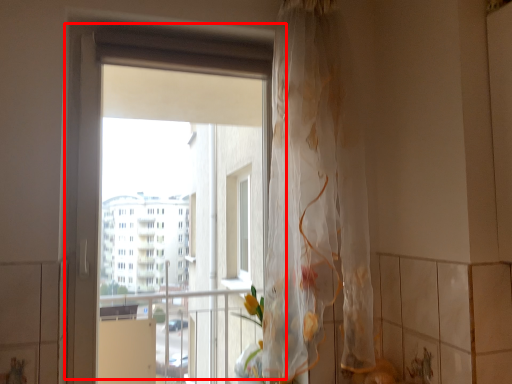
Question: Considering the relative positions of window (annotated by the red box) and curtain in the image provided, where is window (annotated by the red box) located with respect to the staircase?

Choices:
 (A) left
 (B) right

Answer: (A)